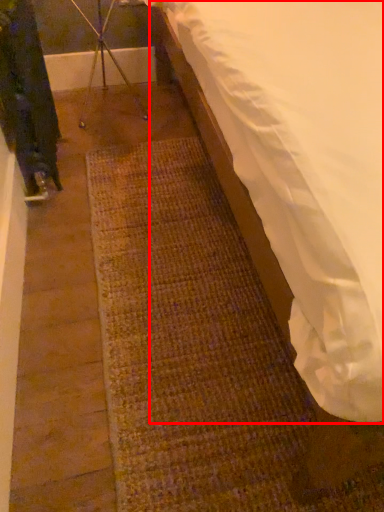
Question: From the image, what is the correct spatial relationship of mattress (annotated by the red box) in relation to tripod?

Choices:
 (A) left
 (B) right

Answer: (B)